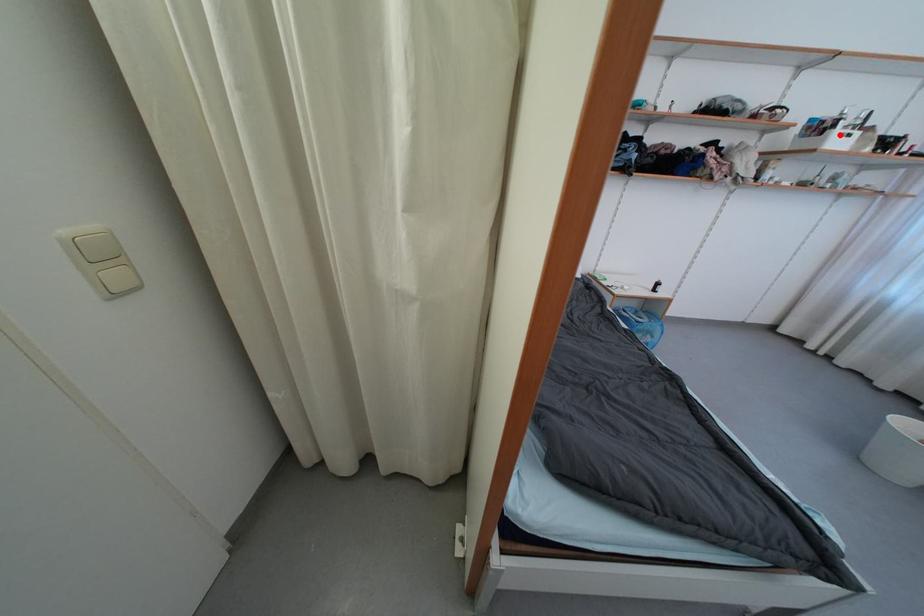
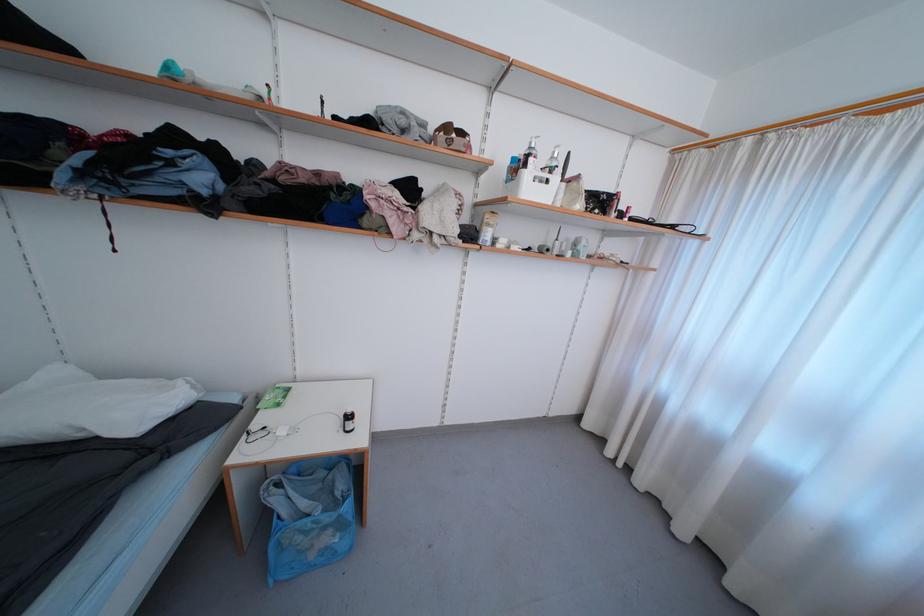
Question: I am providing you with two images of the same scene from different viewpoints. In image1, a red point is highlighted. Considering the same 3D point in image2, which of the following is correct?

Choices:
 (A) It is closer
 (B) It is farther

Answer: (A)